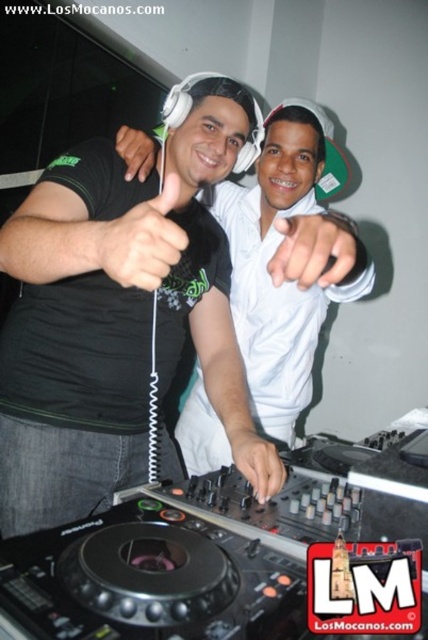
You are a photographer at the event and want to capture both the black matte hand at center and the matte black hand at upper center in a single shot. Which hand should you focus on first to ensure both are in frame?

The black matte hand at center is shorter than the matte black hand at upper center, so focusing on the matte black hand at upper center first will ensure both are within the frame.

You are a photographer at the event and want to capture a photo where the white matte hand at center and the matte black hand at upper center are both visible. Based on their positions, which hand should you ensure is closer to the left side of the frame?

The matte black hand at upper center should be positioned closer to the left side of the frame since the white matte hand at center is to the right of it.